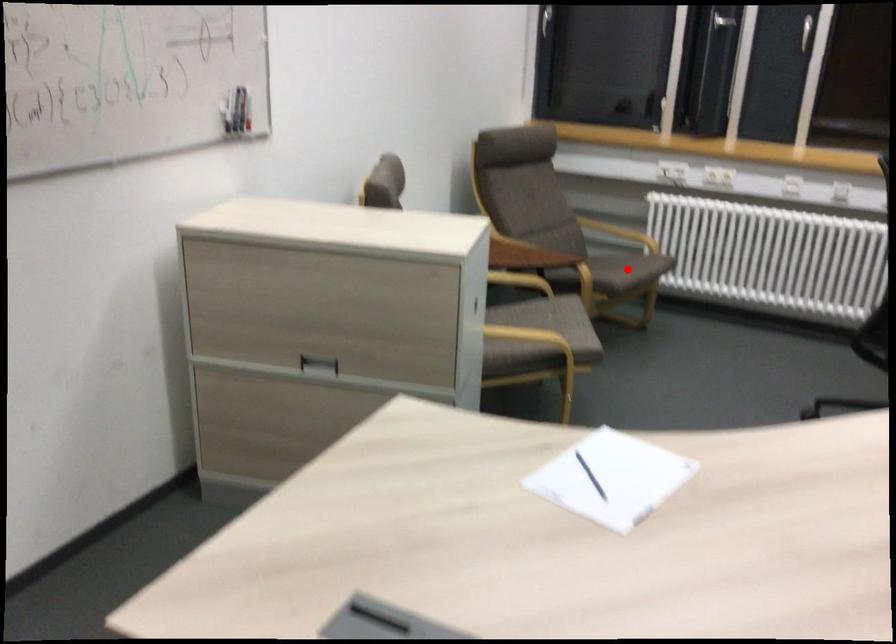
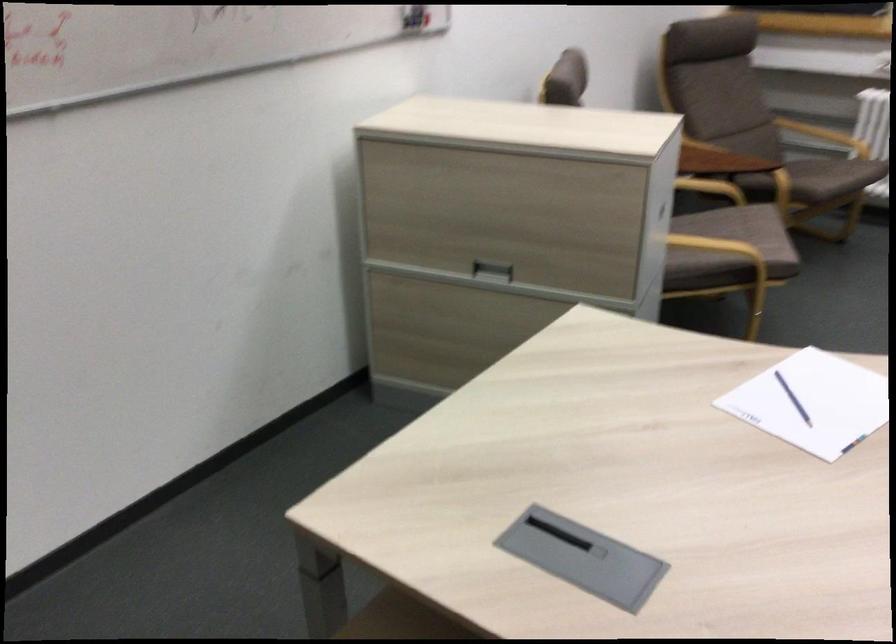
Where in the second image is the point corresponding to the highlighted location from the first image?

(831, 176)